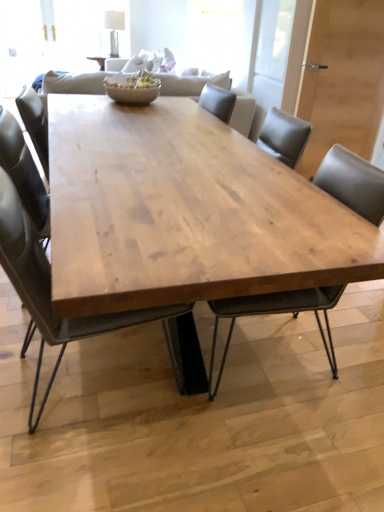
Question: Is natural wood table at center wider or thinner than matte brown bowl at center?

Choices:
 (A) wide
 (B) thin

Answer: (A)

Question: From a real-world perspective, is natural wood table at center above or below matte brown bowl at center?

Choices:
 (A) above
 (B) below

Answer: (B)

Question: Based on their relative distances, which object is farther from the matte brown bowl at center?

Choices:
 (A) natural wood table at center
 (B) matte wood chair at center, the 1th chair viewed from the right
 (C) matte black chair at center, the first chair when ordered from left to right

Answer: (B)

Question: Based on their relative distances, which object is farther from the matte wood chair at center, which appears as the 2th chair when viewed from the left?

Choices:
 (A) natural wood table at center
 (B) matte black chair at center, the second chair when ordered from right to left
 (C) matte brown bowl at center

Answer: (C)